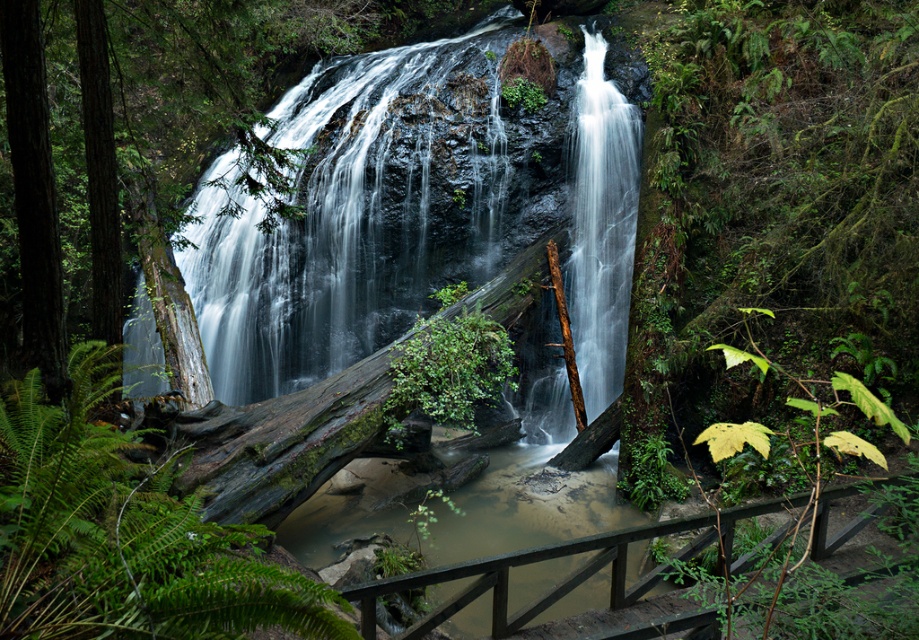
You are a hiker who wants to cross the green mossy log at center. The white smooth water at center is flowing over it. Can you safely step onto the log without getting your feet wet?

The white smooth water at center is taller than the green mossy log at center, so the water is covering the log. Therefore, stepping onto the green mossy log at center would get your feet wet.

You are a hiker trying to cross the water near the brown wooden rail at lower center and the green mossy log at center. Which object is shorter and could be easier to step over?

The brown wooden rail at lower center is not as tall as the green mossy log at center, so it is shorter and easier to step over.

You are standing at the base of the waterfall in the forest scene. There are two points marked in the image. Which point, point [184,541] or point [577,332], is closer to you?

Point [184,541] is closer to the viewer than point [577,332].